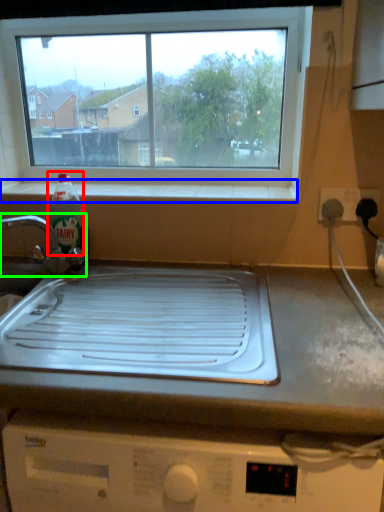
Question: Which is farther away from bottle (highlighted by a red box)? window sill (highlighted by a blue box) or tap (highlighted by a green box)?

Choices:
 (A) window sill
 (B) tap

Answer: (A)